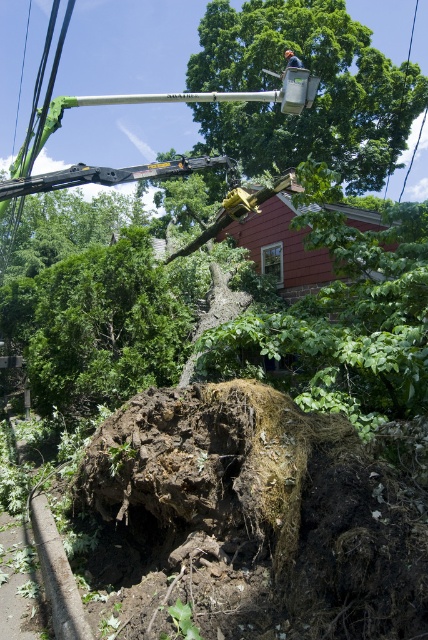
Question: Estimate the real-world distances between objects in this image. Which object is closer to the green leafy tree at lower left?

Choices:
 (A) green leafy tree at upper center
 (B) brushed metal helmet at upper center

Answer: (B)

Question: Can you confirm if green leafy tree at lower left is thinner than brushed metal helmet at upper center?

Choices:
 (A) no
 (B) yes

Answer: (A)

Question: Among these objects, which one is farthest from the camera?

Choices:
 (A) brushed metal helmet at upper center
 (B) green leafy tree at upper center

Answer: (B)

Question: Which object appears closest to the camera in this image?

Choices:
 (A) green leafy tree at lower left
 (B) brushed metal helmet at upper center
 (C) green leafy tree at upper center

Answer: (A)

Question: Does green leafy tree at upper center have a smaller size compared to green leafy tree at lower left?

Choices:
 (A) yes
 (B) no

Answer: (B)

Question: Is green leafy tree at upper center to the left of brushed metal helmet at upper center from the viewer's perspective?

Choices:
 (A) yes
 (B) no

Answer: (A)